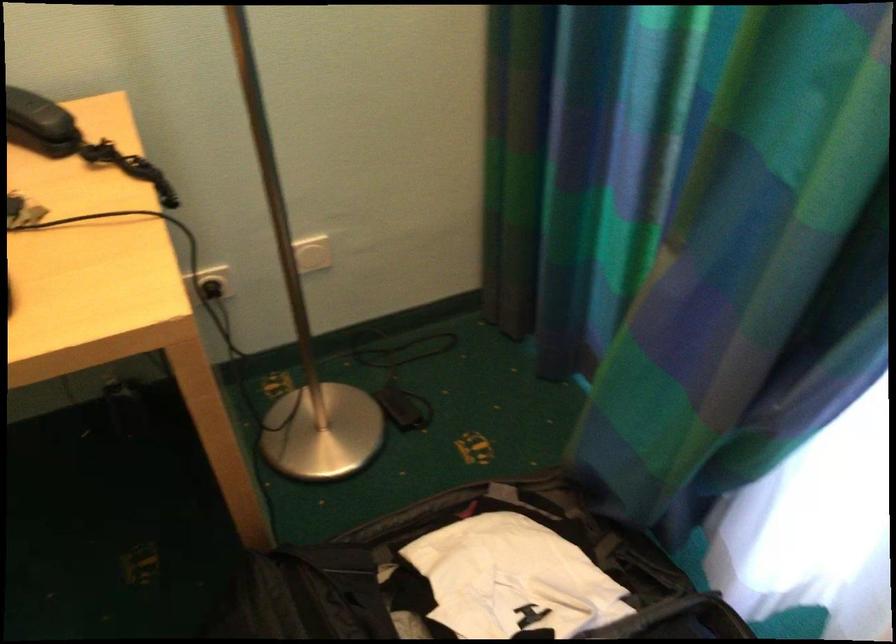
The location [403,408] corresponds to which object?

It refers to a black foot switch.